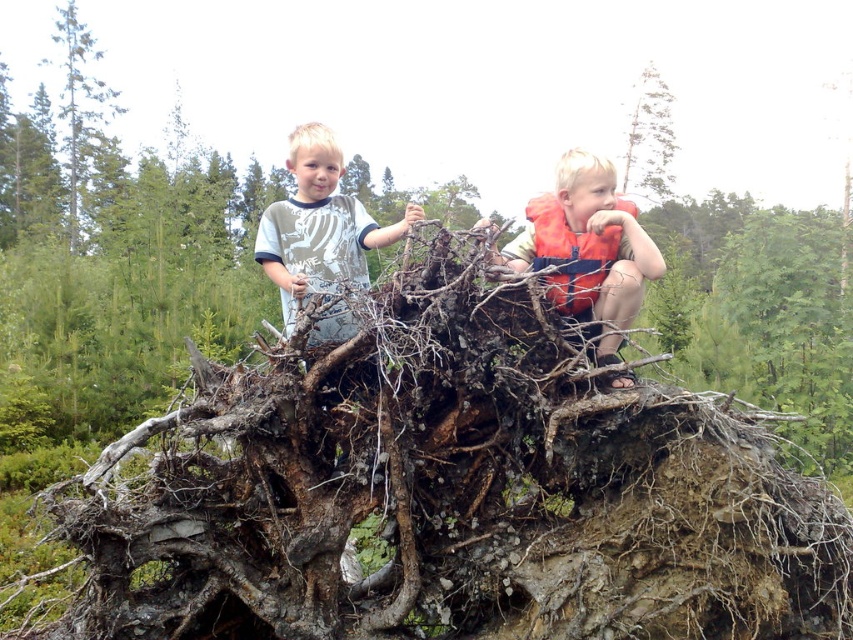
Who is more distant from viewer, [57,140] or [612,381]?

The point [57,140] is more distant.

Does brown rough tree roots at center appear on the left side of orange life vest at center?

Yes, brown rough tree roots at center is to the left of orange life vest at center.

Does point (430, 77) come in front of point (566, 204)?

No.

At what (x,y) coordinates should I click in order to perform the action: click on brown rough tree roots at center. Please return your answer as a coordinate pair (x, y). This screenshot has width=853, height=640. Looking at the image, I should click on (404, 180).

Does matte gray t-shirt at upper left have a greater height compared to smooth bark tree at upper right?

No, matte gray t-shirt at upper left is not taller than smooth bark tree at upper right.

Who is more distant from viewer, (335,234) or (633,122)?

Point (633,122)

You are a GUI agent. You are given a task and a screenshot of the screen. Output one action in this format:
    pyautogui.click(x=<x>, y=<y>)
    Task: Click on the matte gray t-shirt at upper left
    
    Given the screenshot: What is the action you would take?
    pyautogui.click(x=318, y=225)

Can you confirm if orange life vest at center is taller than matte gray t-shirt at upper left?

Yes.

Is orange life vest at center bigger than matte gray t-shirt at upper left?

Correct, orange life vest at center is larger in size than matte gray t-shirt at upper left.

Does point (618, 376) lie in front of point (352, 216)?

Yes.

Identify the location of orange life vest at center. The image size is (853, 640). (589, 250).